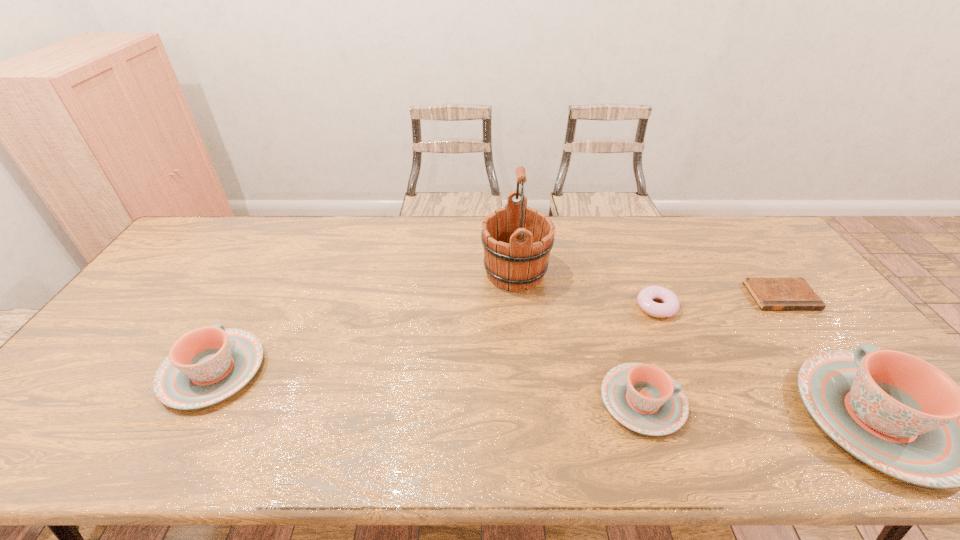
Point out which object is positioned as the second nearest to the tallest object. Please provide its 2D coordinates. Your answer should be formatted as a tuple, i.e. [(x, y)], where the tuple contains the x and y coordinates of a point satisfying the conditions above.

[(642, 397)]

The width and height of the screenshot is (960, 540). Identify the location of the fifth closest object to the diary. (207, 365).

This screenshot has height=540, width=960. I want to click on chinaware object that ranks as the third closest to the shortest object, so click(207, 365).

Find the location of a particular element. The width and height of the screenshot is (960, 540). chinaware that is the closest to the second chinaware from right to left is located at coordinates (897, 413).

Locate an element on the screen. The image size is (960, 540). vacant space that satisfies the following two spatial constraints: 1. on the spine side of the diary; 2. on the handle side of the second chinaware from right to left is located at coordinates (859, 401).

Where is `vacant region that satisfies the following two spatial constraints: 1. on the handle side of the doughnut; 2. on the right side of the fourth shortest object`? vacant region that satisfies the following two spatial constraints: 1. on the handle side of the doughnut; 2. on the right side of the fourth shortest object is located at coordinates (250, 307).

You are a GUI agent. You are given a task and a screenshot of the screen. Output one action in this format:
    pyautogui.click(x=<x>, y=<y>)
    Task: Click on the free space that satisfies the following two spatial constraints: 1. on the handle side of the doughnut; 2. on the left side of the leftmost chinaware
    This screenshot has height=540, width=960.
    Given the screenshot: What is the action you would take?
    pyautogui.click(x=250, y=307)

Identify the location of vacant position in the image that satisfies the following two spatial constraints: 1. on the front side of the wine bucket; 2. on the right side of the doughnut. (518, 307).